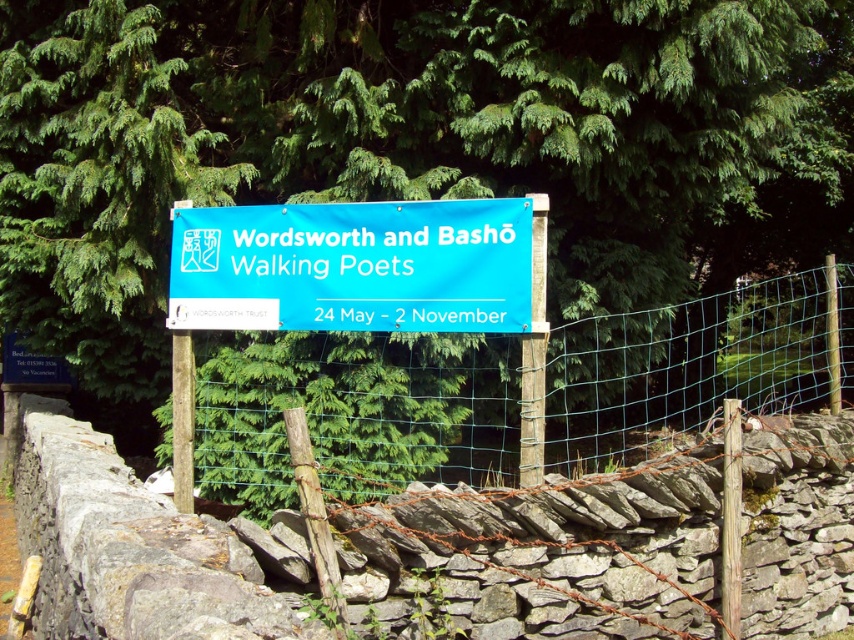
You are an event planner checking the visibility of the signboard. Which object, the green leafy tree at upper center or the green wire mesh at center, could potentially block the view of the signboard more significantly?

The green leafy tree at upper center might block the view of the signboard more significantly than the green wire mesh at center because it is wider.

You are standing in front of the signboard and want to take a photo that includes both the signboard and the green leafy tree at upper center. Based on their positions, where should you position yourself to ensure both are in the frame?

The green leafy tree at upper center is located at point (414, 141), so you should position yourself to the left of the signboard to include both the signboard and the tree in the frame.

You are standing in front of the signboard and want to touch both points mentioned. Which point should you reach for first, the point at coordinates point (756, 324) or point (270, 218)?

You should reach for point (270, 218) first because it is closer to you than point (756, 324), which is further away.